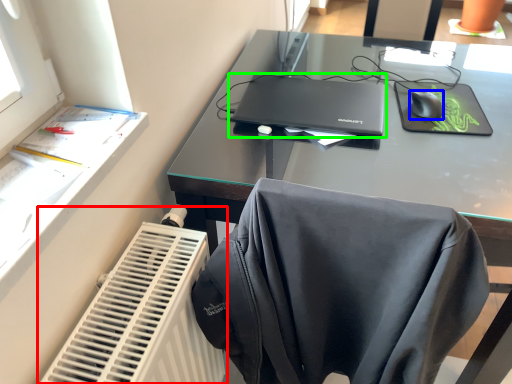
Question: Estimate the real-world distances between objects in this image. Which object is farther from radiator (highlighted by a red box), mouse (highlighted by a blue box) or laptop (highlighted by a green box)?

Choices:
 (A) mouse
 (B) laptop

Answer: (A)